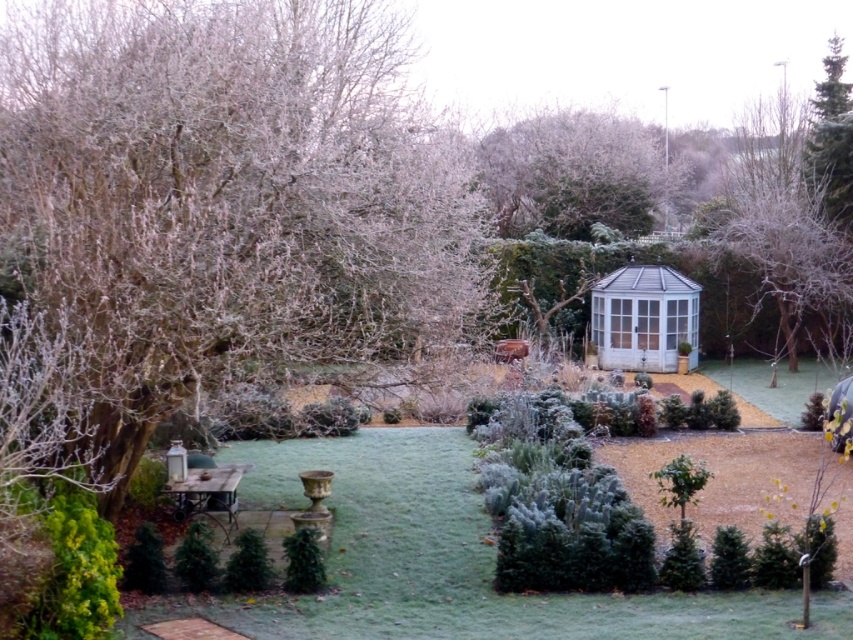
Does frosted bark tree at left appear over frosted green tree at upper center?

Actually, frosted bark tree at left is below frosted green tree at upper center.

Does point (378, 204) lie in front of point (582, 221)?

Yes, point (378, 204) is closer to viewer.

Locate an element on the screen. The height and width of the screenshot is (640, 853). frosted bark tree at left is located at coordinates (229, 198).

Does green textured evergreen tree at upper right lie in front of green matte bush at center?

No.

In order to click on green textured evergreen tree at upper right in this screenshot , I will do `click(833, 138)`.

Is green textured evergreen tree at upper right to the right of green textured bush at lower center from the viewer's perspective?

Correct, you'll find green textured evergreen tree at upper right to the right of green textured bush at lower center.

Between point (845, 106) and point (241, 588), which one is positioned behind?

Positioned behind is point (845, 106).

Which is behind, point (816, 150) or point (254, 564)?

The point (816, 150) is more distant.

You are a GUI agent. You are given a task and a screenshot of the screen. Output one action in this format:
    pyautogui.click(x=<x>, y=<y>)
    Task: Click on the green textured evergreen tree at upper right
    Image resolution: width=853 pixels, height=640 pixels.
    Given the screenshot: What is the action you would take?
    pyautogui.click(x=833, y=138)